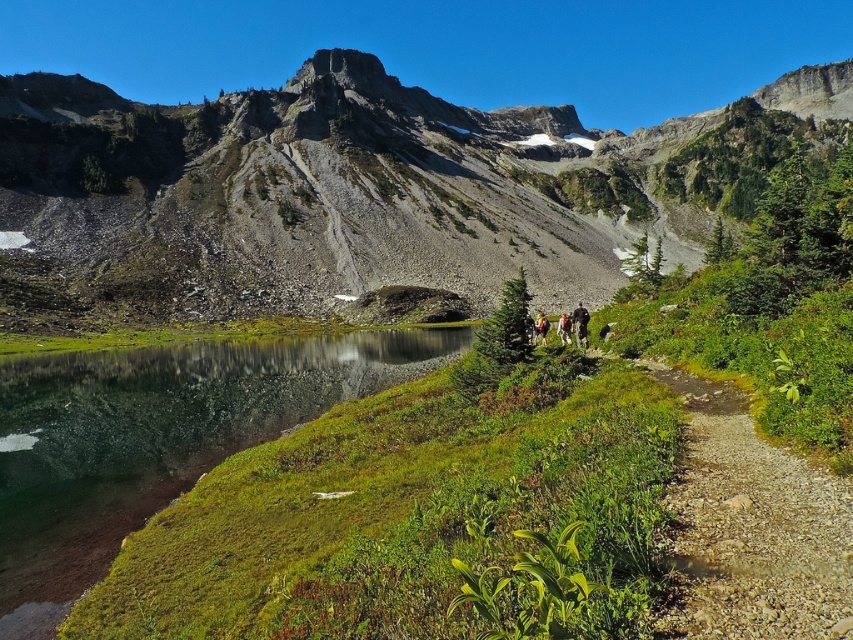
You are a photographer standing on the dirt path in the mountain meadow. You notice two jackets hanging on a nearby tree branch at the center of the scene. The jackets are labeled as the dark gray jacket at center and the camouflage fabric jacket at center. Which jacket would you choose if you want to carry a smaller one for your hike?

The dark gray jacket at center has a smaller size compared to the camouflage fabric jacket at center, so you should choose the dark gray jacket at center for a smaller option.

You are a hiker standing at the start of the dirt path in the meadow. You notice two jackets hanging on a nearby tree branch. Which jacket is closer to the ground, the dark gray jacket at center or the camouflage fabric jacket at center?

The dark gray jacket at center is closer to the ground because it is positioned below the camouflage fabric jacket at center.